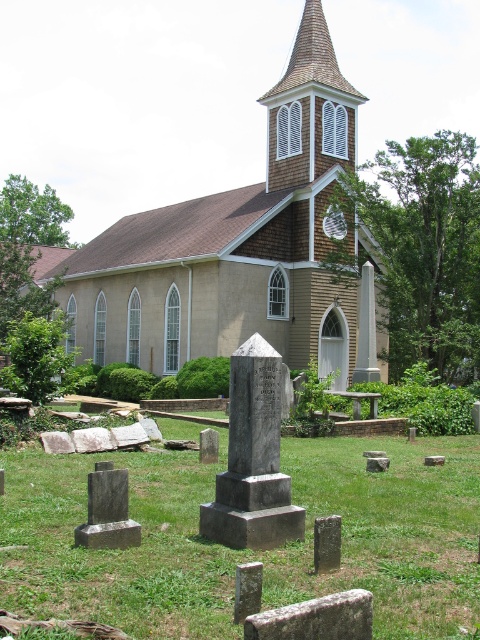
Question: Is green grass at center positioned behind beige stucco church at center?

Choices:
 (A) yes
 (B) no

Answer: (B)

Question: Which point appears closest to the camera in this image?

Choices:
 (A) (216, 296)
 (B) (415, 499)

Answer: (B)

Question: Can you confirm if green grass at center is bigger than beige stucco church at center?

Choices:
 (A) no
 (B) yes

Answer: (A)

Question: From the image, what is the correct spatial relationship of green grass at center in relation to beige stucco church at center?

Choices:
 (A) right
 (B) left

Answer: (A)

Question: Which of the following is the farthest from the observer?

Choices:
 (A) (229, 284)
 (B) (342, 492)

Answer: (A)